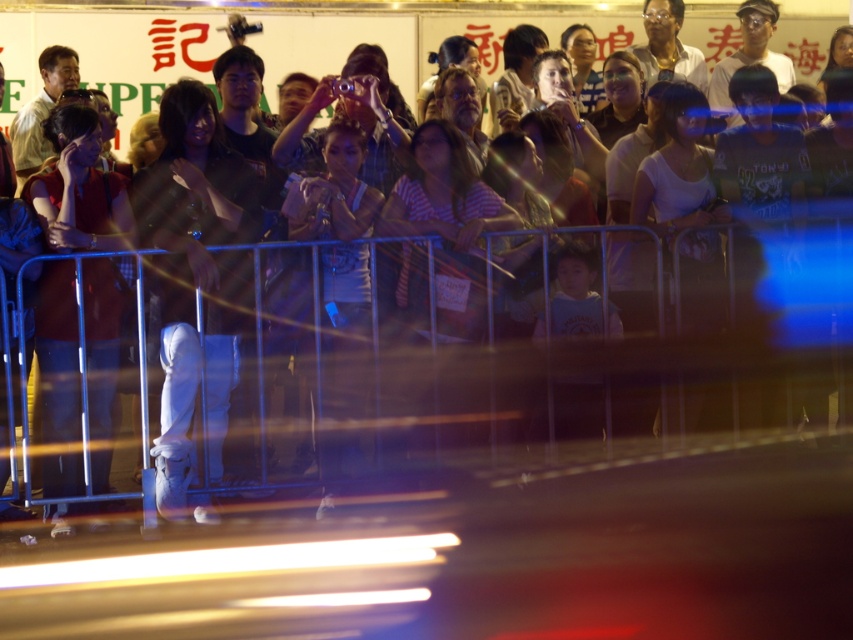
You are a photographer standing in the crowd and want to take a clear photo of the banner with red Chinese characters. You notice the white leather boots at center and the matte red shirt at center are blocking your view. Which object is taller and might be obstructing your view more?

The white leather boots at center is taller than the matte red shirt at center, so it might be obstructing your view more.

You are a photographer trying to capture a clear shot of the white leather boots at center and the matte red shirt at center in the crowd. Which object should you focus on to ensure it appears clearer in the photo?

The white leather boots at center is larger in size than the matte red shirt at center, so focusing on the white leather boots at center would result in a clearer image since larger objects generally hold more detail and are easier to focus on in a crowded scene.